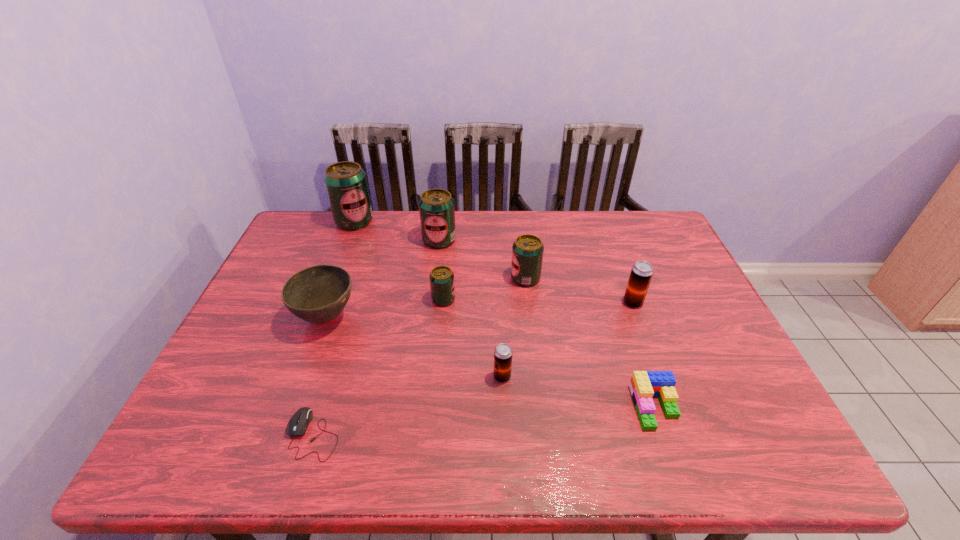
Find the location of a particular element. Image resolution: width=960 pixels, height=540 pixels. vacant area situated 0.310m on the left of the smallest green beer can is located at coordinates (321, 299).

At what (x,y) coordinates should I click in order to perform the action: click on vacant area located on the back of the smaller black beer can. Please return your answer as a coordinate pair (x, y). Looking at the image, I should click on (499, 305).

Identify the location of free spot located 0.370m on the left of the Lego. This screenshot has height=540, width=960. (468, 407).

The image size is (960, 540). In order to click on free space located 0.210m on the right of the shortest object in this screenshot , I will do `click(440, 434)`.

Where is `Lego that is at the near edge`? The width and height of the screenshot is (960, 540). Lego that is at the near edge is located at coordinates (643, 385).

Locate an element on the screen. computer mouse that is at the near edge is located at coordinates (297, 425).

You are a GUI agent. You are given a task and a screenshot of the screen. Output one action in this format:
    pyautogui.click(x=<x>, y=<y>)
    Task: Click on the beer can that is positioned at the left edge
    The height and width of the screenshot is (540, 960).
    Given the screenshot: What is the action you would take?
    pyautogui.click(x=346, y=184)

I want to click on bowl that is at the left edge, so click(318, 294).

Locate an element on the screen. The width and height of the screenshot is (960, 540). object located at the far left corner is located at coordinates (346, 184).

In the image, there is a desktop. Where is `vacant space at the far edge`? The image size is (960, 540). vacant space at the far edge is located at coordinates (469, 238).